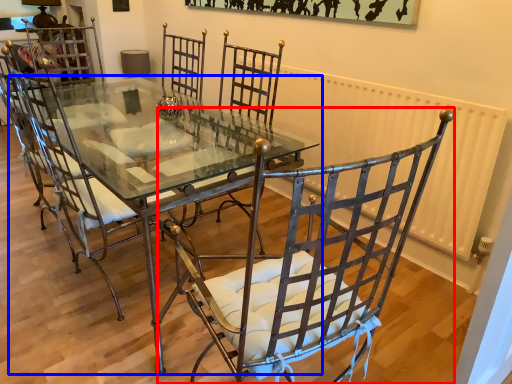
Question: Which object appears closest to the camera in this image, chair (highlighted by a red box) or table (highlighted by a blue box)?

Choices:
 (A) chair
 (B) table

Answer: (A)